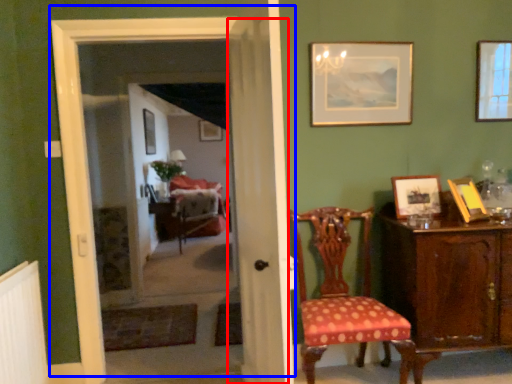
Question: Which object appears closest to the camera in this image, curtain (highlighted by a red box) or door (highlighted by a blue box)?

Choices:
 (A) curtain
 (B) door

Answer: (A)